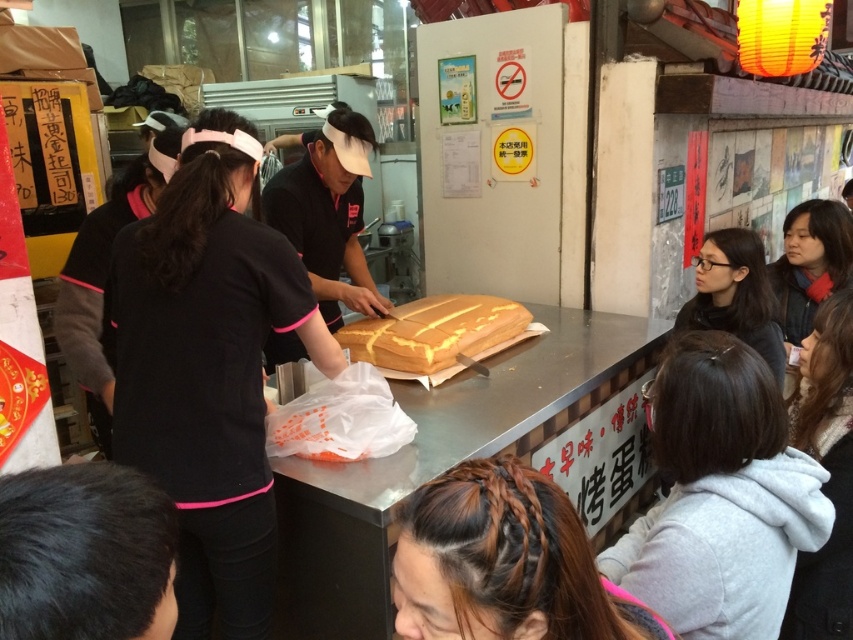
Which of these two, black fabric jacket at left or matte black hair at right, stands shorter?

matte black hair at right

Is black fabric jacket at left taller than matte black hair at right?

Correct, black fabric jacket at left is much taller as matte black hair at right.

Which is behind, point (97, 300) or point (708, 292)?

Positioned behind is point (708, 292).

Locate an element on the screen. This screenshot has height=640, width=853. black fabric jacket at left is located at coordinates (105, 276).

Is gray fleece at lower right to the right of black hair at lower left from the viewer's perspective?

Correct, you'll find gray fleece at lower right to the right of black hair at lower left.

Between point (761, 492) and point (115, 468), which one is positioned in front?

Positioned in front is point (115, 468).

Between point (738, 387) and point (90, 516), which one is positioned in front?

Point (90, 516) is in front.

The height and width of the screenshot is (640, 853). What are the coordinates of `gray fleece at lower right` in the screenshot? It's located at (721, 497).

Is brown braided hair at lower center closer to the viewer compared to light brown hair at lower right?

Yes, brown braided hair at lower center is in front of light brown hair at lower right.

Is brown braided hair at lower center above light brown hair at lower right?

Indeed, brown braided hair at lower center is positioned over light brown hair at lower right.

At what (x,y) coordinates should I click in order to perform the action: click on brown braided hair at lower center. Please return your answer as a coordinate pair (x, y). Looking at the image, I should click on (505, 561).

Identify the location of brown braided hair at lower center. This screenshot has width=853, height=640. (505, 561).